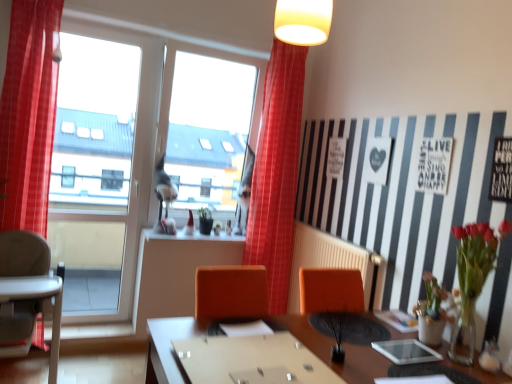
I want to click on free region on the left part of green matte plant at center, the 2th plant from the back, so click(x=314, y=349).